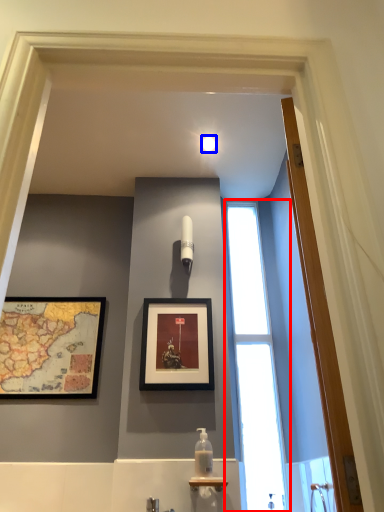
Question: Which object is closer to the camera taking this photo, window (highlighted by a red box) or light fixture (highlighted by a blue box)?

Choices:
 (A) window
 (B) light fixture

Answer: (A)